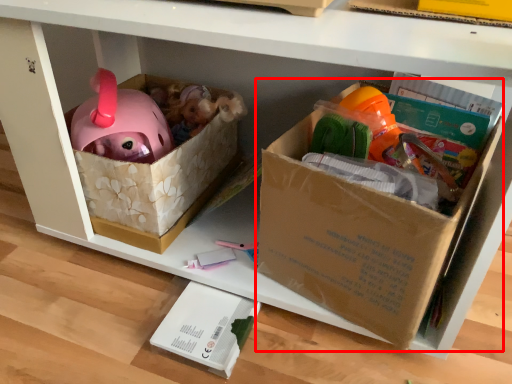
Question: From the image's perspective, considering the relative positions of cardboard box (annotated by the red box) and box in the image provided, where is cardboard box (annotated by the red box) located with respect to the staircase?

Choices:
 (A) above
 (B) below

Answer: (A)